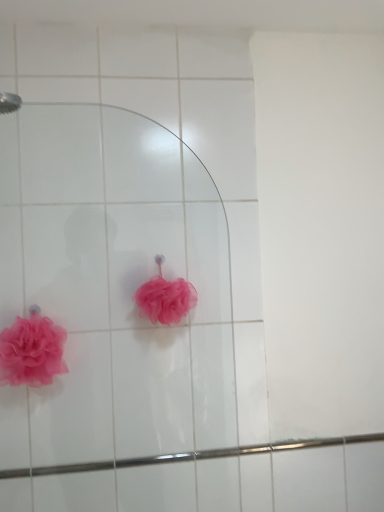
Question: Choose the correct answer: Is matte pink loofah at lower left, the 2th flower positioned from the right, inside pink fluffy loofah at center, which ranks as the second flower in left-to-right order, or outside it?

Choices:
 (A) outside
 (B) inside

Answer: (A)

Question: Would you say matte pink loofah at lower left, which is counted as the first flower, starting from the left, is to the left or to the right of pink fluffy loofah at center, arranged as the first flower when viewed from the right, in the picture?

Choices:
 (A) left
 (B) right

Answer: (A)

Question: Considering the positions of matte pink loofah at lower left, the 2th flower positioned from the right, and pink fluffy loofah at center, which ranks as the second flower in left-to-right order, in the image, is matte pink loofah at lower left, the 2th flower positioned from the right, wider or thinner than pink fluffy loofah at center, which ranks as the second flower in left-to-right order,?

Choices:
 (A) wide
 (B) thin

Answer: (B)

Question: From the image's perspective, is pink fluffy loofah at center, which ranks as the second flower in left-to-right order, located above or below matte pink loofah at lower left, which is counted as the first flower, starting from the left?

Choices:
 (A) below
 (B) above

Answer: (B)

Question: Is pink fluffy loofah at center, arranged as the first flower when viewed from the right, to the left or to the right of matte pink loofah at lower left, which is counted as the first flower, starting from the left, in the image?

Choices:
 (A) left
 (B) right

Answer: (B)

Question: Do you think pink fluffy loofah at center, which ranks as the second flower in left-to-right order, is within matte pink loofah at lower left, the 2th flower positioned from the right, or outside of it?

Choices:
 (A) outside
 (B) inside

Answer: (A)

Question: Relative to matte pink loofah at lower left, the 2th flower positioned from the right, is pink fluffy loofah at center, arranged as the first flower when viewed from the right, in front or behind?

Choices:
 (A) front
 (B) behind

Answer: (B)